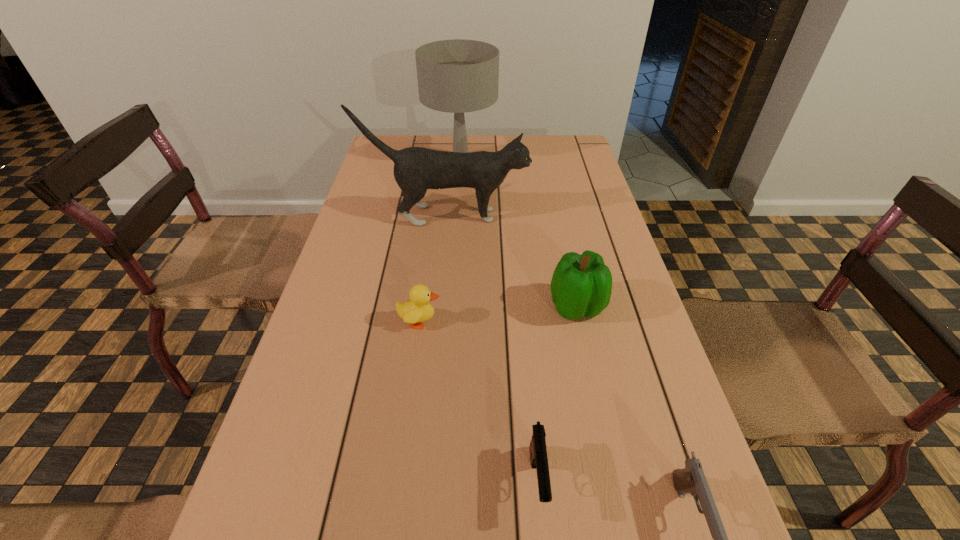
The width and height of the screenshot is (960, 540). I want to click on object that is at the far edge, so click(x=457, y=76).

Identify the location of object positioned at the left edge. (416, 169).

Where is `object present at the right edge`? The width and height of the screenshot is (960, 540). object present at the right edge is located at coordinates (581, 285).

Where is `free space at the far edge of the desktop`? This screenshot has width=960, height=540. free space at the far edge of the desktop is located at coordinates (430, 139).

Image resolution: width=960 pixels, height=540 pixels. Identify the location of free space at the left edge of the desktop. (342, 374).

Identify the location of vacant region at the right edge of the desktop. (x=595, y=173).

Locate an element on the screen. blank region between the duckling and the second farthest object is located at coordinates tap(433, 268).

This screenshot has height=540, width=960. Identify the location of free space between the duckling and the fifth nearest object. (433, 268).

The width and height of the screenshot is (960, 540). In order to click on blank region between the second farthest object and the duckling in this screenshot , I will do `click(433, 268)`.

Locate an element on the screen. The image size is (960, 540). unoccupied position between the duckling and the farthest object is located at coordinates (441, 240).